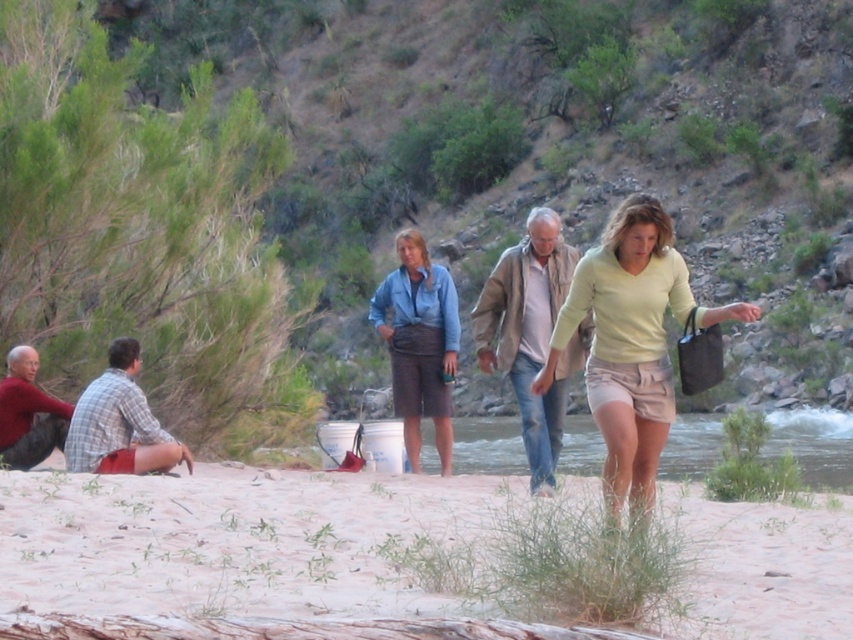
You are standing at the edge of the riverbank and want to move to the light beige sand at lower center. Which direction should you walk from the matte red shirt at lower left?

The light beige sand at lower center is to the right of the matte red shirt at lower left, so you should walk to the right from the matte red shirt at lower left to reach the light beige sand at lower center.